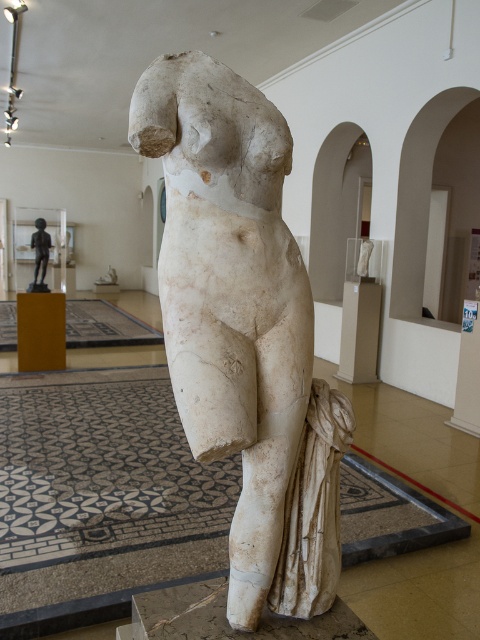
You are an art conservator assessing the space between two sculptures in a museum. The white marble statue at center and the bronze figure at left are positioned close to each other. Can you determine if there is enough space between them to safely move a 1.2 meter wide conservation cart through?

The white marble statue at center is wider than the bronze figure at left. However, the exact distance between them isn

You are an art curator planning to install a new exhibit. You have two statues to display side by side. The white marble statue at center and the bronze figure at left. If you want to create a visual hierarchy where the taller object is placed in a position of prominence, which statue should you place in the central position?

The white marble statue at center is much taller than the bronze figure at left, so to create a visual hierarchy with the taller object in prominence, you should place the white marble statue at center in the central position.